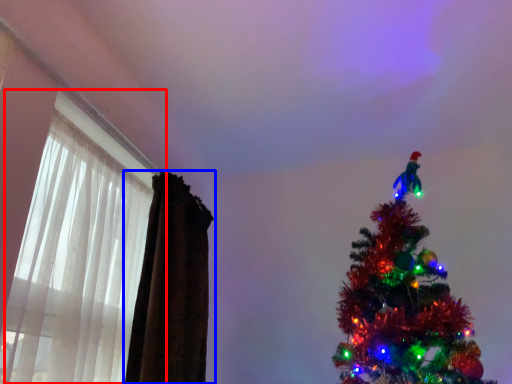
Question: Which object appears closest to the camera in this image, window (highlighted by a red box) or curtain (highlighted by a blue box)?

Choices:
 (A) window
 (B) curtain

Answer: (A)